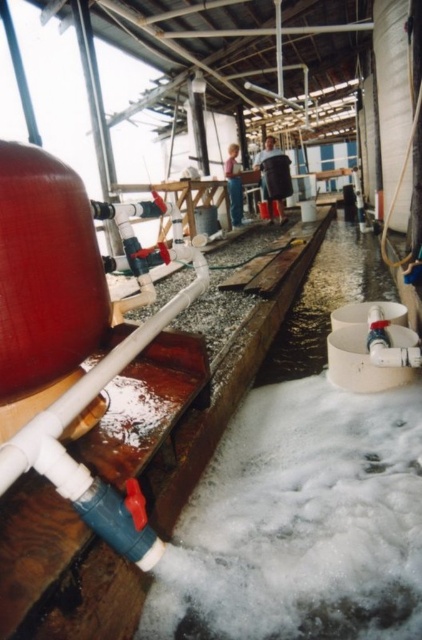
Which is more to the right, foamy white water at center or metallic pipe at center?

metallic pipe at center

Is foamy white water at center smaller than metallic pipe at center?

Correct, foamy white water at center occupies less space than metallic pipe at center.

Who is more distant from viewer, (156, 602) or (254, 88)?

Positioned behind is point (254, 88).

In order to click on foamy white water at center in this screenshot , I will do `click(306, 492)`.

Is point (230, 177) closer to camera compared to point (286, 106)?

Yes, point (230, 177) is closer to viewer.

Does blue shirt at center have a lesser width compared to metallic pipe at center?

Indeed, blue shirt at center has a lesser width compared to metallic pipe at center.

You are a GUI agent. You are given a task and a screenshot of the screen. Output one action in this format:
    pyautogui.click(x=<x>, y=<y>)
    Task: Click on the blue shirt at center
    The height and width of the screenshot is (640, 422).
    Given the screenshot: What is the action you would take?
    pyautogui.click(x=234, y=184)

Where is `blue shirt at center`? This screenshot has width=422, height=640. blue shirt at center is located at coordinates (234, 184).

Who is more forward, (102, 496) or (284, 102)?

Positioned in front is point (102, 496).

Is white matte pipe at center-left in front of metallic pipe at center?

Yes, white matte pipe at center-left is closer to the viewer.

Who is more distant from viewer, (129, 481) or (294, 104)?

The point (294, 104) is behind.

Locate an element on the screen. white matte pipe at center-left is located at coordinates (97, 394).